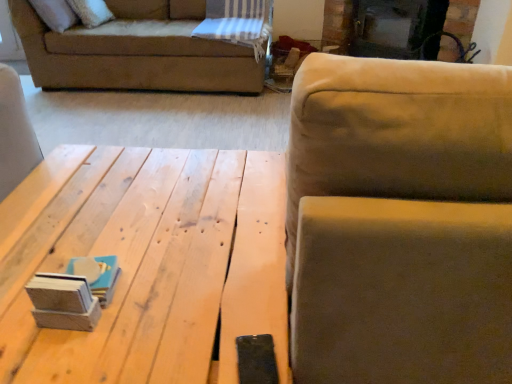
Question: From the image's perspective, is natural wood table at center positioned above or below suede-like beige couch at upper right?

Choices:
 (A) above
 (B) below

Answer: (B)

Question: Is natural wood table at center inside the boundaries of suede-like beige couch at upper right, or outside?

Choices:
 (A) inside
 (B) outside

Answer: (B)

Question: Which object is positioned farthest from the black glass fireplace at upper center?

Choices:
 (A) suede-like beige couch at upper right
 (B) natural wood table at center

Answer: (A)

Question: Which is farther from the suede-like beige couch at upper right?

Choices:
 (A) natural wood table at center
 (B) black glass fireplace at upper center

Answer: (B)